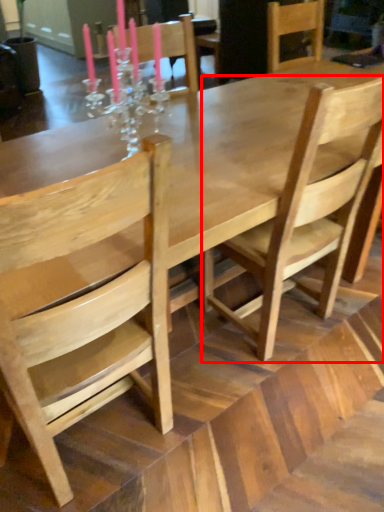
Question: From the image's perspective, what is the correct spatial positioning of chair (annotated by the red box) in reference to chair?

Choices:
 (A) below
 (B) above

Answer: (B)